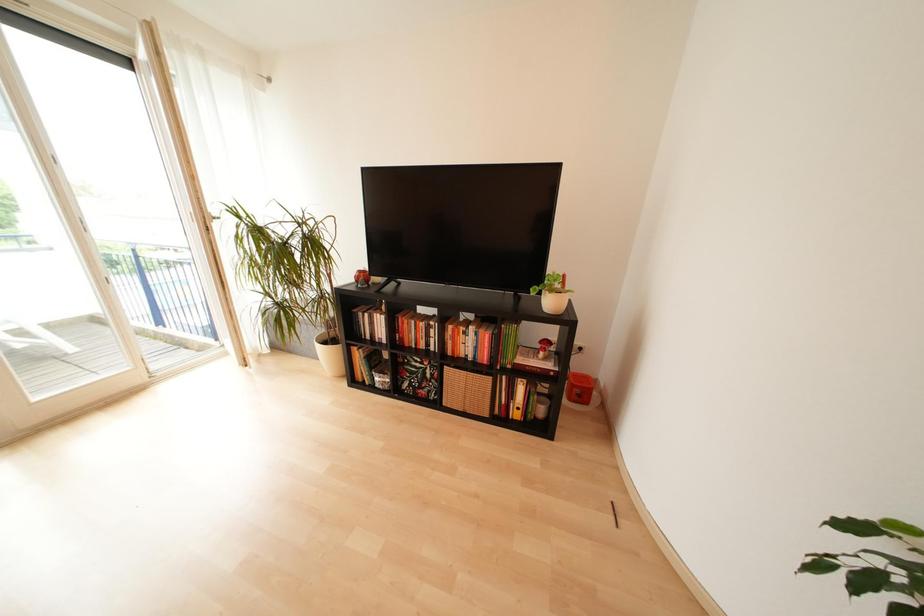
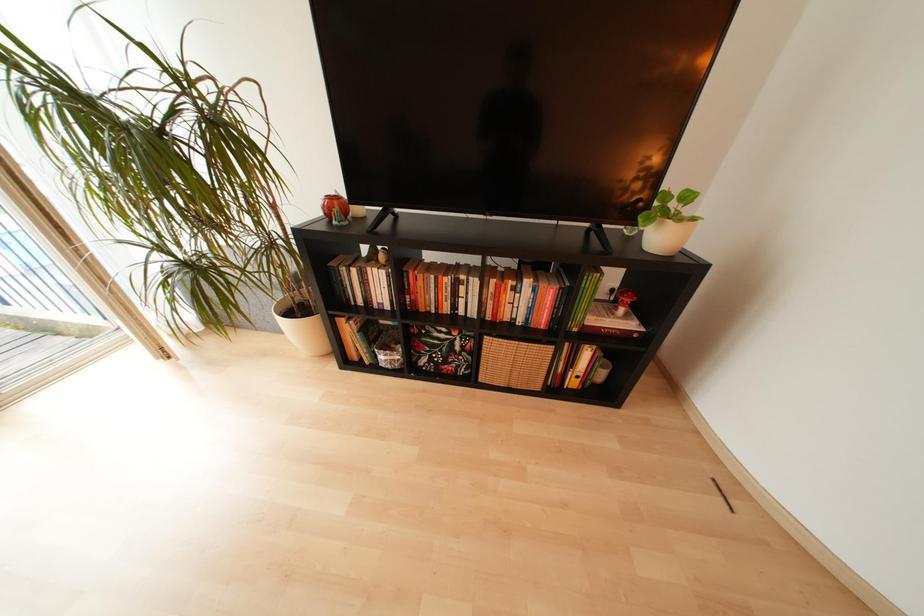
What movement of the cameraman would produce the second image?

The movement direction of the cameraman is left, forward.